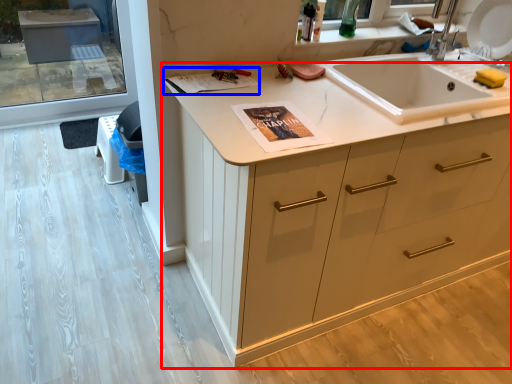
Question: Which of the following is the farthest to the observer, cabinetry (highlighted by a red box) or magazine (highlighted by a blue box)?

Choices:
 (A) cabinetry
 (B) magazine

Answer: (B)